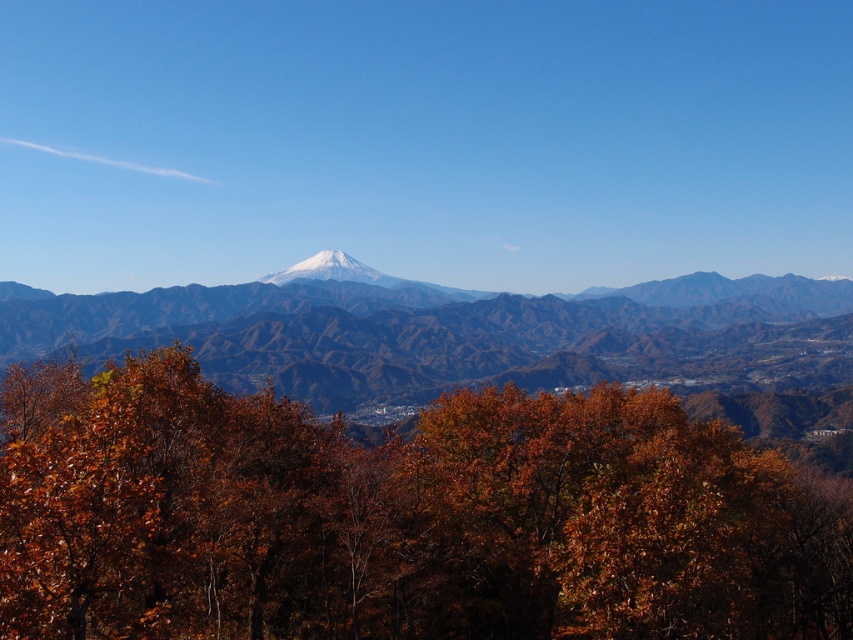
Between brown matte tree at center and blue-gray mountain range at center, which one is positioned lower?

brown matte tree at center is below.

Find the location of a particular element. The height and width of the screenshot is (640, 853). brown matte tree at center is located at coordinates (399, 516).

At what (x,y) coordinates should I click in order to perform the action: click on brown matte tree at center. Please return your answer as a coordinate pair (x, y). Looking at the image, I should click on click(399, 516).

In order to click on brown matte tree at center in this screenshot , I will do `click(399, 516)`.

Does point (245, 349) come in front of point (285, 282)?

Yes, point (245, 349) is in front of point (285, 282).

Is blue-gray mountain range at center in front of white snow-capped peak at center?

That is True.

Between point (225, 349) and point (347, 280), which one is positioned behind?

Point (347, 280)

Identify the location of blue-gray mountain range at center. (457, 333).

Can you confirm if brown matte tree at center is positioned to the left of white snow-capped peak at center?

In fact, brown matte tree at center is to the right of white snow-capped peak at center.

Can you confirm if brown matte tree at center is positioned to the right of white snow-capped peak at center?

Indeed, brown matte tree at center is positioned on the right side of white snow-capped peak at center.

Measure the distance between point (727, 608) and camera.

A distance of 34.48 meters exists between point (727, 608) and camera.

Locate an element on the screen. The width and height of the screenshot is (853, 640). brown matte tree at center is located at coordinates (399, 516).